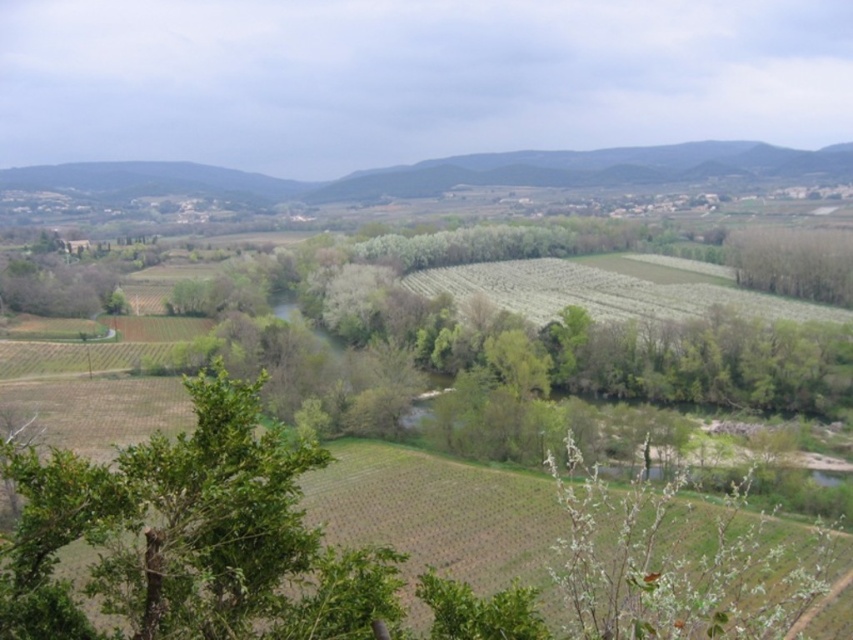
Question: Does green leafy tree at lower left appear on the left side of green leafy trees at right?

Choices:
 (A) yes
 (B) no

Answer: (A)

Question: Which point is closer to the camera taking this photo?

Choices:
 (A) pyautogui.click(x=44, y=557)
 (B) pyautogui.click(x=833, y=301)

Answer: (A)

Question: Considering the relative positions of green leafy tree at lower left and green leafy trees at right in the image provided, where is green leafy tree at lower left located with respect to green leafy trees at right?

Choices:
 (A) below
 (B) above

Answer: (A)

Question: Can you confirm if green leafy tree at lower left is positioned to the right of green leafy trees at right?

Choices:
 (A) no
 (B) yes

Answer: (A)

Question: Which point is closer to the camera?

Choices:
 (A) green leafy trees at right
 (B) green leafy tree at lower left

Answer: (B)